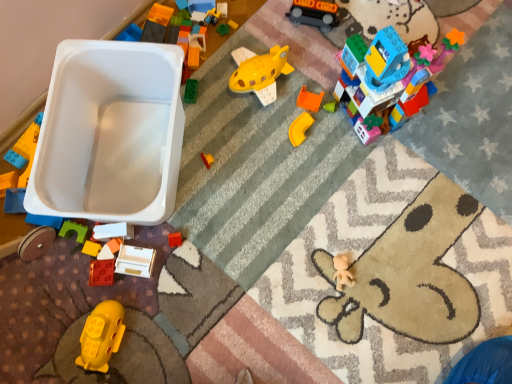
I want to click on free area in between yellow matte plastic corner piece at center-right, positioned as the third toy in top-to-bottom order, and white matte block at lower left, which ranks as the 4th toy in left-to-right order, so click(224, 175).